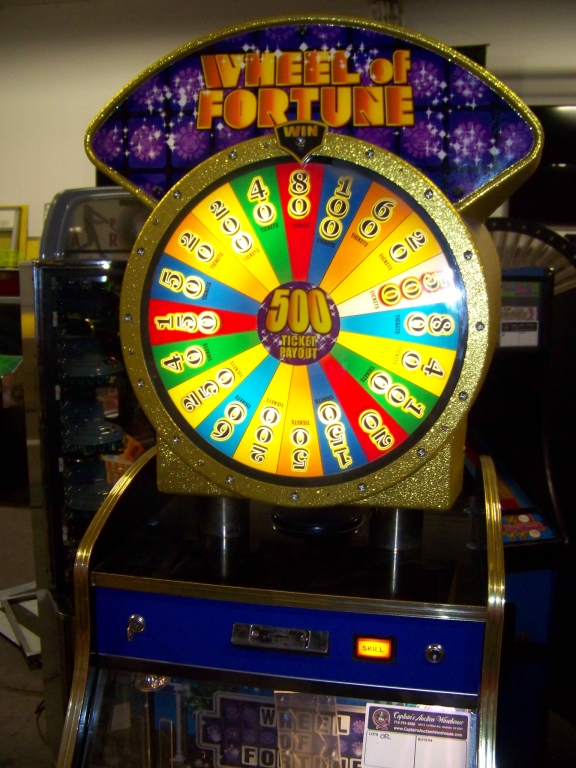
This screenshot has width=576, height=768. Identify the location of wall. (65, 81).